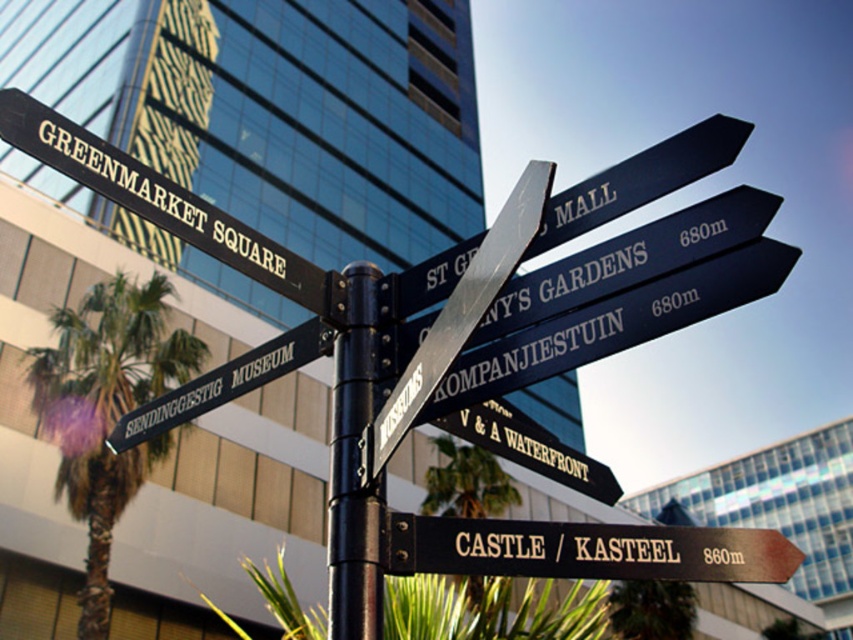
You are standing in the middle of the street and want to reach both the green leafy palm tree at left and the brown wooden sign at lower right. Given that you can only move forward and cannot turn around, which object will you encounter first?

The brown wooden sign at lower right will be encountered first because it is closer to the observer compared to the green leafy palm tree at left, as there is a distance of 50.33 feet between them.